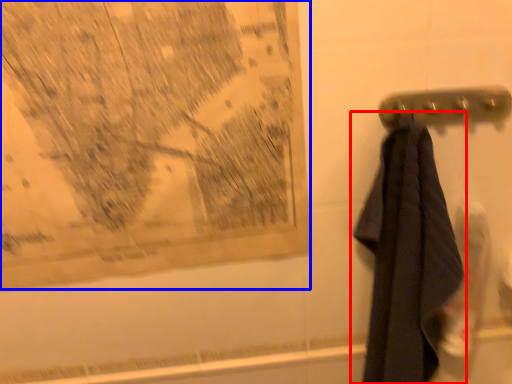
Question: Among these objects, which one is farthest to the camera, towel (highlighted by a red box) or map (highlighted by a blue box)?

Choices:
 (A) towel
 (B) map

Answer: (B)